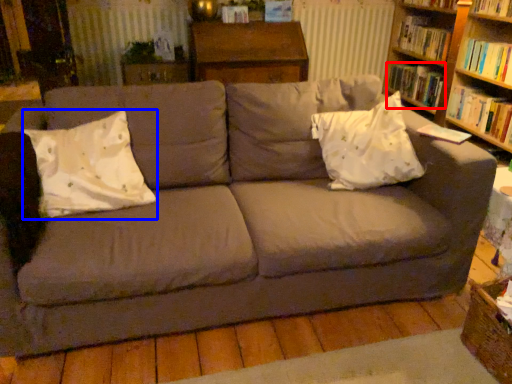
Question: Which object appears closest to the camera in this image, book (highlighted by a red box) or throw pillow (highlighted by a blue box)?

Choices:
 (A) book
 (B) throw pillow

Answer: (B)